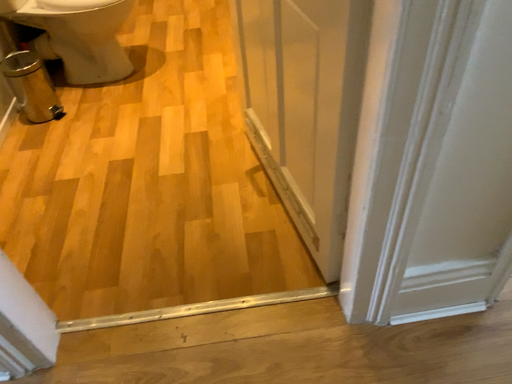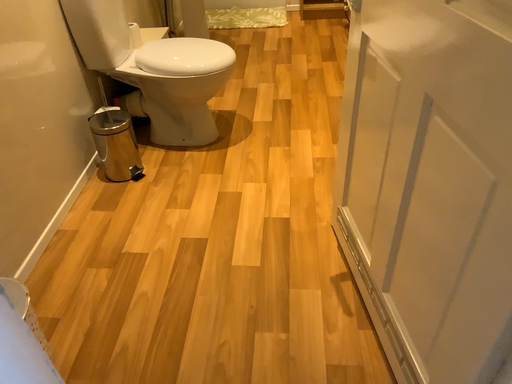
Question: Which way did the camera rotate in the video?

Choices:
 (A) rotated upward
 (B) rotated downward

Answer: (A)